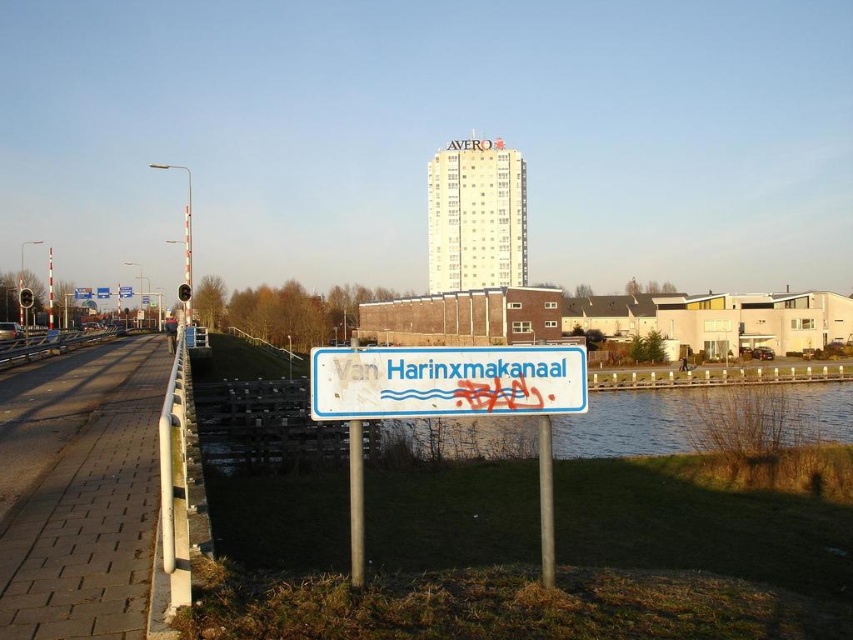
How much distance is there between metallic pole at center and metallic gray pole at center?

The distance of metallic pole at center from metallic gray pole at center is 4.08 meters.

Which is more to the left, metallic pole at center or metallic gray pole at center?

Positioned to the left is metallic pole at center.

Which is in front, point (357, 454) or point (552, 497)?

Point (357, 454) is more forward.

Where is `metallic pole at center`? This screenshot has width=853, height=640. metallic pole at center is located at coordinates (357, 502).

Can you confirm if white plastic sign at center is positioned below metallic gray pole at center?

A: Actually, white plastic sign at center is above metallic gray pole at center.

Who is shorter, white plastic sign at center or metallic gray pole at center?

Standing shorter between the two is white plastic sign at center.

Is point (469, 380) positioned after point (550, 577)?

No.

At what (x,y) coordinates should I click in order to perform the action: click on white plastic sign at center. Please return your answer as a coordinate pair (x, y). The image size is (853, 640). Looking at the image, I should click on (445, 381).

Who is positioned more to the right, white plastic sign at center or metallic pole at center?

white plastic sign at center

Is white plastic sign at center below metallic pole at center?

Actually, white plastic sign at center is above metallic pole at center.

This screenshot has height=640, width=853. What do you see at coordinates (445, 381) in the screenshot? I see `white plastic sign at center` at bounding box center [445, 381].

This screenshot has height=640, width=853. In order to click on white plastic sign at center in this screenshot , I will do `click(445, 381)`.